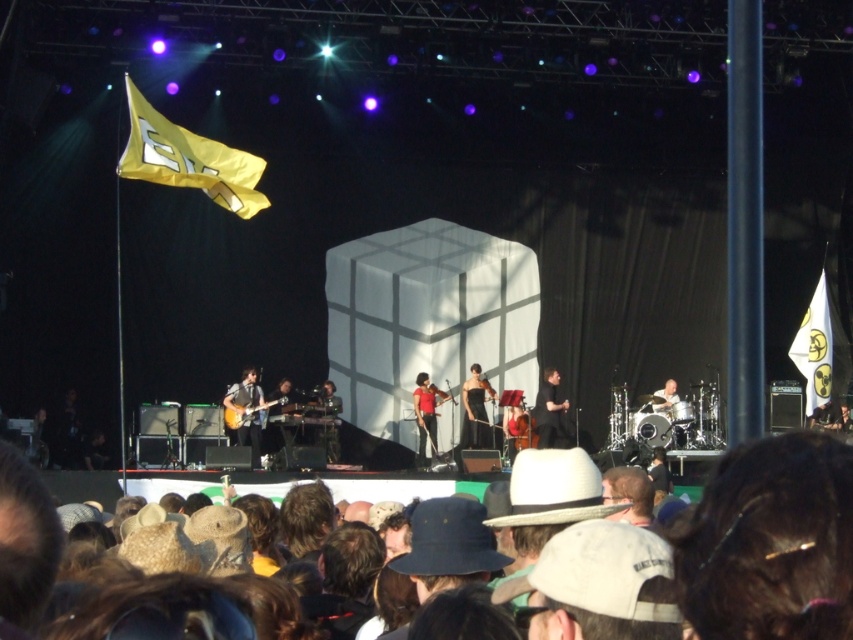
You are a photographer at the concert and want to capture a clear shot of the wooden electric guitar at center without any obstruction. Given that the brown hair at lower right is blocking the view, can you adjust your position to avoid it?

The brown hair at lower right is in front of the wooden electric guitar at center, so moving your position to the left or right should allow you to avoid the obstruction caused by the brown hair at lower right and get a clear shot of the wooden electric guitar at center.